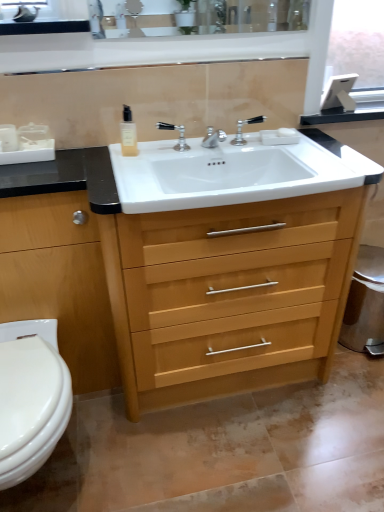
At what (x,y) coordinates should I click in order to perform the action: click on light wood/wooden vanity at center. Please return your answer as a coordinate pair (x, y). The height and width of the screenshot is (512, 384). Looking at the image, I should click on (223, 272).

Measure the distance between point (343, 147) and camera.

A distance of 4.92 feet exists between point (343, 147) and camera.

Describe the element at coordinates (228, 173) in the screenshot. I see `white glossy sink at center` at that location.

Describe the element at coordinates (8, 138) in the screenshot. I see `white plastic container at left` at that location.

Measure the distance between point (17, 148) and camera.

The distance of point (17, 148) from camera is 1.34 meters.

Measure the distance between point (25, 216) and camera.

They are 1.24 meters apart.

What is the approximate height of light wood/finish chest of drawers at left?

It is 35.66 inches.

This screenshot has height=512, width=384. What are the coordinates of `light wood/wooden vanity at center` in the screenshot? It's located at (223, 272).

Is white glossy toilet at lower left not within light wood/finish chest of drawers at left?

Absolutely, white glossy toilet at lower left is external to light wood/finish chest of drawers at left.

From a real-world perspective, is white glossy toilet at lower left positioned under light wood/finish chest of drawers at left based on gravity?

Yes, from a real-world perspective, white glossy toilet at lower left is under light wood/finish chest of drawers at left.

Does white glossy toilet at lower left have a larger size compared to light wood/finish chest of drawers at left?

No.

Which is more to the left, white glossy toilet at lower left or light wood/finish chest of drawers at left?

light wood/finish chest of drawers at left.

Is white glossy sink at center facing away from white plastic container at left?

white glossy sink at center is not turned away from white plastic container at left.

From a real-world perspective, between white glossy sink at center and white plastic container at left, who is vertically higher?

From a 3D spatial view, white plastic container at left is above.

In the scene shown: Which object is closer to the camera taking this photo, white glossy sink at center or white plastic container at left?

white glossy sink at center is more forward.

Between white glossy sink at center and white plastic container at left, which one has larger size?

white glossy sink at center is bigger.

Considering their positions, is light wood/wooden vanity at center located in front of or behind white matte soap at upper center?

In the image, light wood/wooden vanity at center appears in front of white matte soap at upper center.

Can you confirm if light wood/wooden vanity at center is thinner than white matte soap at upper center?

In fact, light wood/wooden vanity at center might be wider than white matte soap at upper center.

Measure the distance from light wood/wooden vanity at center to white matte soap at upper center.

27.80 inches.

Identify the location of bathroom cabinet in front of the white matte soap at upper center. (223, 272).

Considering their positions, is polished chrome faucet at center, the second tap positioned from the right, located in front of or behind white glossy sink at center?

Visually, polished chrome faucet at center, the second tap positioned from the right, is located behind white glossy sink at center.

Based on the photo, from their relative heights in the image, would you say polished chrome faucet at center, the second tap positioned from the right, is taller or shorter than white glossy sink at center?

Considering their sizes, polished chrome faucet at center, the second tap positioned from the right, has less height than white glossy sink at center.

You are a GUI agent. You are given a task and a screenshot of the screen. Output one action in this format:
    pyautogui.click(x=<x>, y=<y>)
    Task: Click on the tap on the left of white glossy sink at center
    
    Given the screenshot: What is the action you would take?
    pyautogui.click(x=179, y=135)

From the image's perspective, between polished chrome faucet at center, the first tap positioned from the right, and white glossy toilet at lower left, who is located below?

white glossy toilet at lower left is shown below in the image.

Considering the relative positions of polished chrome faucet at center, the first tap positioned from the right, and white glossy toilet at lower left in the image provided, is polished chrome faucet at center, the first tap positioned from the right, to the right of white glossy toilet at lower left from the viewer's perspective?

Yes.

Is polished chrome faucet at center, placed as the second tap when sorted from left to right, positioned behind white glossy toilet at lower left?

Yes.

Considering the relative sizes of polished chrome faucet at center, placed as the second tap when sorted from left to right, and white glossy toilet at lower left in the image provided, is polished chrome faucet at center, placed as the second tap when sorted from left to right, thinner than white glossy toilet at lower left?

Correct, the width of polished chrome faucet at center, placed as the second tap when sorted from left to right, is less than that of white glossy toilet at lower left.

From a real-world perspective, is light wood/finish chest of drawers at left under polished chrome faucet at center, the first tap positioned from the right?

Yes, from a real-world perspective, light wood/finish chest of drawers at left is under polished chrome faucet at center, the first tap positioned from the right.

Who is bigger, light wood/finish chest of drawers at left or polished chrome faucet at center, the first tap positioned from the right?

light wood/finish chest of drawers at left is bigger.

What's the angular difference between light wood/finish chest of drawers at left and polished chrome faucet at center, the first tap positioned from the right,'s facing directions?

There is a 0.714-degree angle between the facing directions of light wood/finish chest of drawers at left and polished chrome faucet at center, the first tap positioned from the right.

Is light wood/finish chest of drawers at left positioned with its back to polished chrome faucet at center, placed as the second tap when sorted from left to right?

light wood/finish chest of drawers at left does not have its back to polished chrome faucet at center, placed as the second tap when sorted from left to right.

Between polished chrome faucet at center, the first tap in the left-to-right sequence, and polished chrome faucet at center, the first tap positioned from the right, which one has larger width?

polished chrome faucet at center, the first tap positioned from the right, is wider.

Locate an element on the screen. This screenshot has width=384, height=512. tap above the polished chrome faucet at center, the first tap in the left-to-right sequence (from the image's perspective) is located at coordinates (241, 129).

Who is taller, polished chrome faucet at center, the second tap positioned from the right, or polished chrome faucet at center, placed as the second tap when sorted from left to right?

With more height is polished chrome faucet at center, placed as the second tap when sorted from left to right.

Between point (158, 124) and point (260, 121), which one is positioned in front?

The point (158, 124) is closer to the camera.

Identify the location of toilet located below the light wood/finish chest of drawers at left (from the image's perspective). This screenshot has width=384, height=512. (31, 398).

Locate an element on the screen. The image size is (384, 512). sink below the white plastic container at left (from a real-world perspective) is located at coordinates (228, 173).

Which object lies further to the anchor point light wood/wooden vanity at center, light wood/finish chest of drawers at left or polished chrome faucet at center, the first tap in the left-to-right sequence?

polished chrome faucet at center, the first tap in the left-to-right sequence, is positioned further to the anchor light wood/wooden vanity at center.

Looking at the image, which one is located closer to light wood/finish chest of drawers at left, white plastic container at left or white matte soap at upper center?

Among the two, white plastic container at left is located nearer to light wood/finish chest of drawers at left.

From the image, which object appears to be nearer to white glossy sink at center, white plastic container at left or light wood/wooden vanity at center?

light wood/wooden vanity at center.

Considering their positions, is white glossy sink at center positioned further to white plastic container at left than white glossy toilet at lower left?

white glossy toilet at lower left lies further to white plastic container at left than the other object.

Based on their spatial positions, is clear glass soap dispenser at upper center or light wood/finish chest of drawers at left further from polished chrome faucet at center, placed as the second tap when sorted from left to right?

The object further to polished chrome faucet at center, placed as the second tap when sorted from left to right, is light wood/finish chest of drawers at left.

Looking at the image, which one is located closer to white plastic container at left, white matte soap at upper center or polished chrome faucet at center, the first tap positioned from the right?

Based on the image, polished chrome faucet at center, the first tap positioned from the right, appears to be nearer to white plastic container at left.

Based on their spatial positions, is polished chrome faucet at center, placed as the second tap when sorted from left to right, or polished chrome faucet at center, the second tap positioned from the right, closer to white glossy toilet at lower left?

polished chrome faucet at center, the second tap positioned from the right, is positioned closer to the anchor white glossy toilet at lower left.

Estimate the real-world distances between objects in this image. Which object is further from polished chrome faucet at center, the first tap positioned from the right, white matte soap at upper center or polished chrome faucet at center, the second tap positioned from the right?

The object further to polished chrome faucet at center, the first tap positioned from the right, is polished chrome faucet at center, the second tap positioned from the right.

Find the location of `chest of drawers between white plastic container at left and polished chrome faucet at center, placed as the second tap when sorted from left to right, in the horizontal direction`. chest of drawers between white plastic container at left and polished chrome faucet at center, placed as the second tap when sorted from left to right, in the horizontal direction is located at coordinates (59, 281).

Identify the location of toiletry that lies between polished chrome faucet at center, the first tap positioned from the right, and white glossy toilet at lower left from top to bottom. Image resolution: width=384 pixels, height=512 pixels. (8, 138).

Find the location of a particular element. tap between light wood/finish chest of drawers at left and polished chrome faucet at center, the first tap positioned from the right, from left to right is located at coordinates (179, 135).

The height and width of the screenshot is (512, 384). I want to click on bathroom cabinet between polished chrome faucet at center, the first tap in the left-to-right sequence, and white glossy toilet at lower left from top to bottom, so click(x=223, y=272).